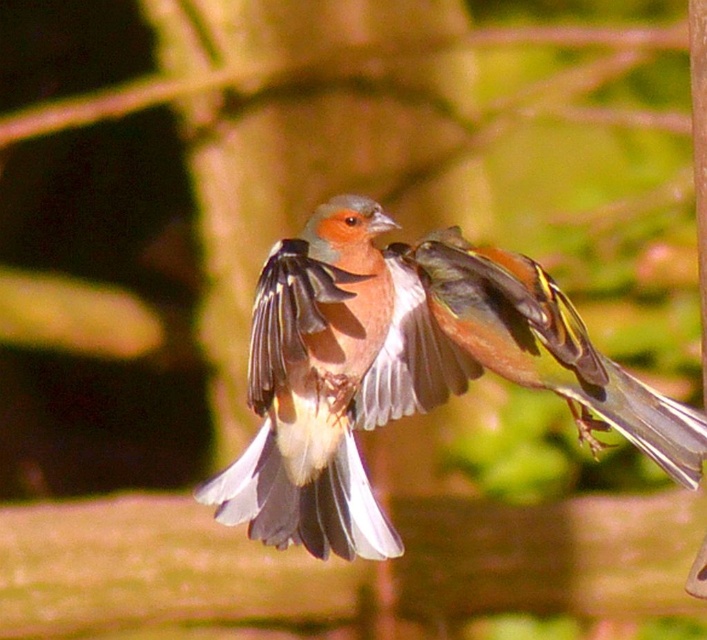
You are a photographer trying to capture the shiny brown bird at center and the matte brown bird at center in the same frame. Based on their sizes, which bird would appear closer to the camera?

The shiny brown bird at center appears larger than the matte brown bird at center, so it would be closer to the camera.

You are a photographer who wants to capture the bird in flight. You notice two birds in the scene, a shiny brown bird at center and a matte brown bird at center. Which bird should you focus on to ensure the best shot given the shallow depth of field?

The shiny brown bird at center is much taller than the matte brown bird at center, so focusing on the shiny brown bird at center will ensure it remains the focal point with the shallow depth of field.